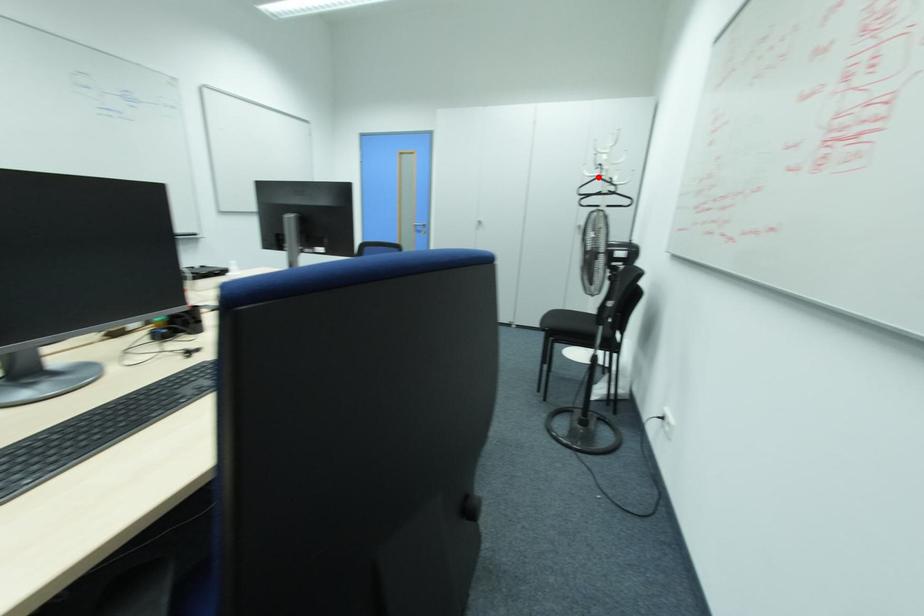
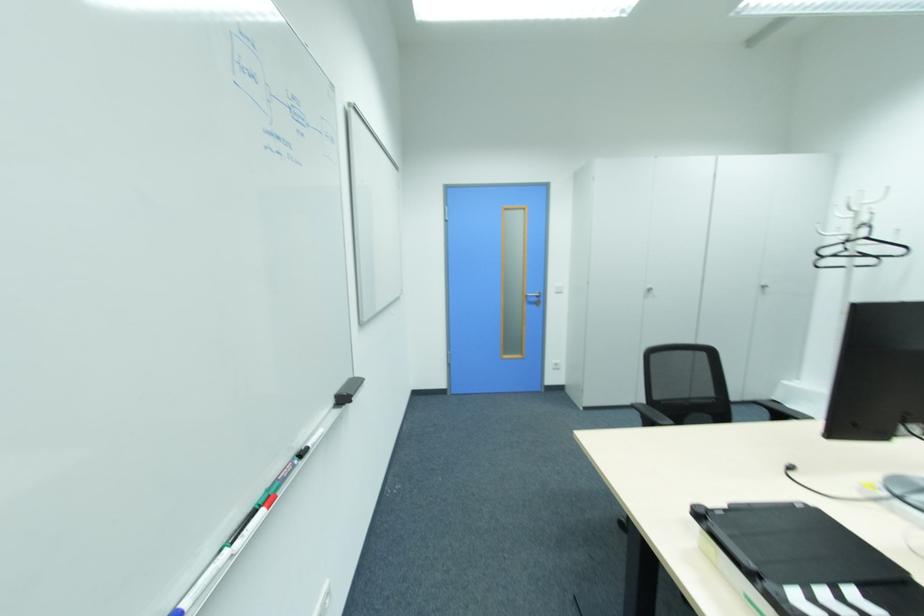
Question: I am providing you with two images of the same scene from different viewpoints. A red point is marked on the first image. Is the red point's position out of view in image 2?

Choices:
 (A) Yes
 (B) No

Answer: (B)